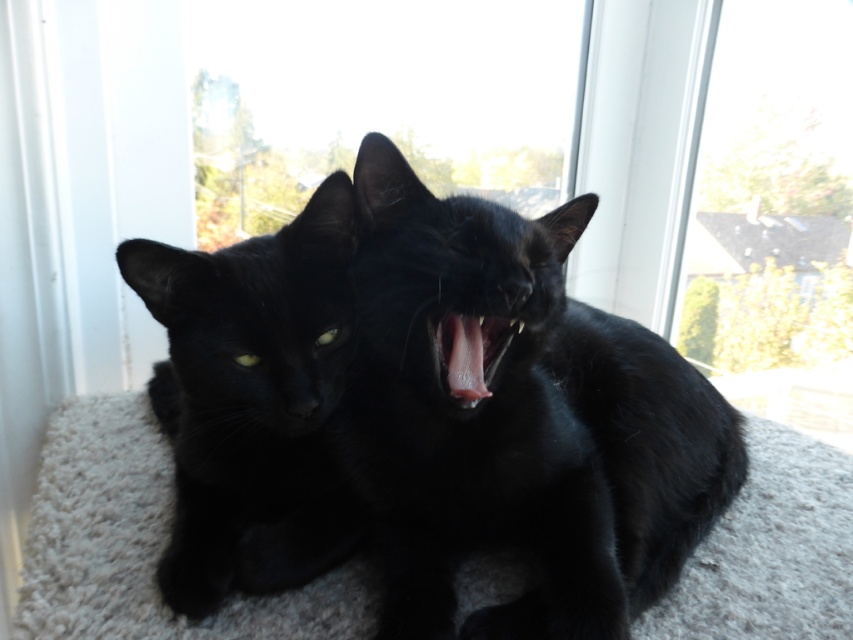
Can you confirm if black silky cat at center is wider than white carpet at lower center?

No, black silky cat at center is not wider than white carpet at lower center.

Is black silky cat at center smaller than white carpet at lower center?

Correct, black silky cat at center occupies less space than white carpet at lower center.

Is point (399, 323) positioned behind point (44, 630)?

No.

Where is `black silky cat at center`? This screenshot has width=853, height=640. black silky cat at center is located at coordinates (519, 420).

Can you confirm if black silky cat at center is positioned above pink glossy tongue at center?

No.

Is point (630, 401) positioned in front of point (444, 384)?

No, (630, 401) is behind (444, 384).

Where is `black silky cat at center`? This screenshot has height=640, width=853. black silky cat at center is located at coordinates (519, 420).

Is point (775, 538) closer to camera compared to point (311, 560)?

No, (775, 538) is behind (311, 560).

Measure the distance between point (697, 586) and camera.

27.92 inches

Between point (734, 563) and point (344, 204), which one is positioned in front?

Positioned in front is point (344, 204).

Find the location of a particular element. Image resolution: width=853 pixels, height=640 pixels. white carpet at lower center is located at coordinates (142, 544).